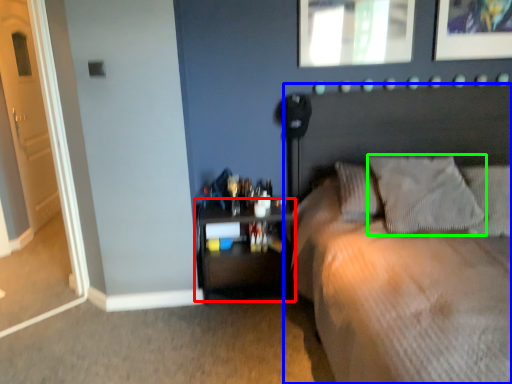
Question: Which is nearer to the nightstand (highlighted by a red box)? bed (highlighted by a blue box) or pillow (highlighted by a green box).

Choices:
 (A) bed
 (B) pillow

Answer: (A)